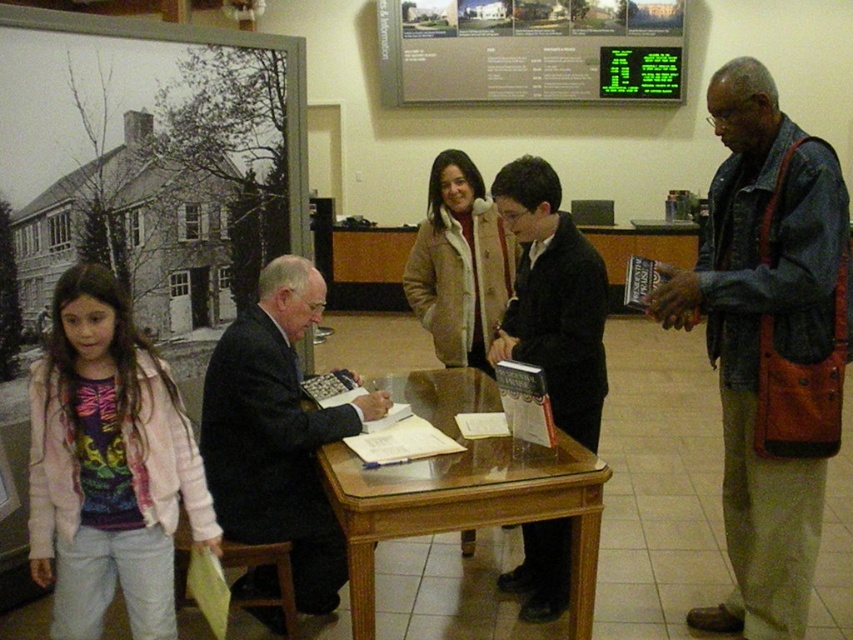
Is denim jacket at right thinner than black suit jacket at center?

In fact, denim jacket at right might be wider than black suit jacket at center.

Does denim jacket at right lie in front of black suit jacket at center?

Yes, denim jacket at right is in front of black suit jacket at center.

This screenshot has height=640, width=853. I want to click on denim jacket at right, so click(x=759, y=337).

This screenshot has height=640, width=853. In order to click on denim jacket at right in this screenshot , I will do `click(759, 337)`.

Can you confirm if light pink fleece jacket at left is positioned to the right of green digital display at upper center?

Incorrect, light pink fleece jacket at left is not on the right side of green digital display at upper center.

Which is behind, point (140, 608) or point (608, 93)?

Point (608, 93)

At what (x,y) coordinates should I click in order to perform the action: click on light pink fleece jacket at left. Please return your answer as a coordinate pair (x, y). Image resolution: width=853 pixels, height=640 pixels. Looking at the image, I should click on (108, 465).

Does light pink fleece jacket at left appear under black suit jacket at center?

Yes, light pink fleece jacket at left is below black suit jacket at center.

Which is below, light pink fleece jacket at left or black suit jacket at center?

light pink fleece jacket at left

This screenshot has width=853, height=640. What are the coordinates of `light pink fleece jacket at left` in the screenshot? It's located at (108, 465).

The width and height of the screenshot is (853, 640). Find the location of `light pink fleece jacket at left`. light pink fleece jacket at left is located at coordinates (108, 465).